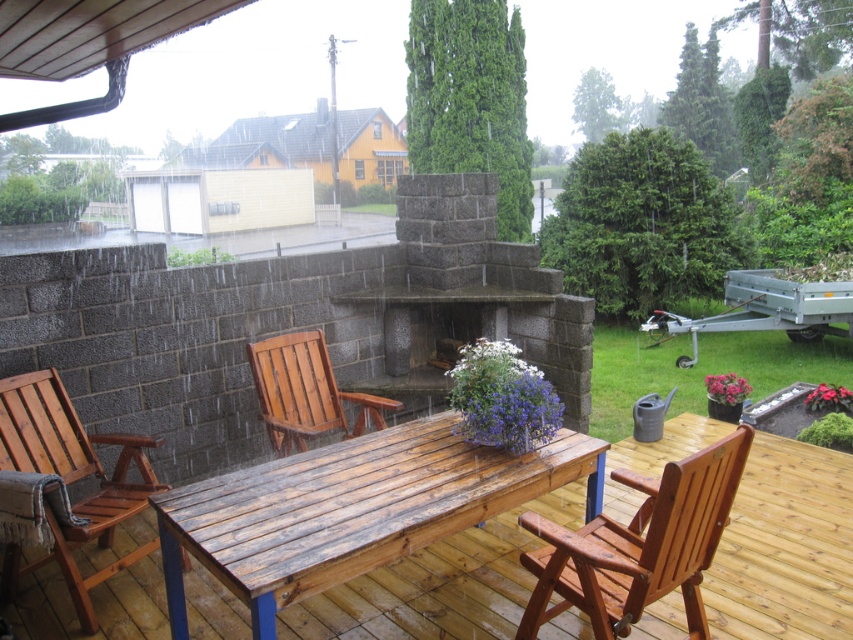
Question: Which of the following is the farthest from the observer?

Choices:
 (A) (439, 272)
 (B) (683, 496)

Answer: (A)

Question: Which point is closer to the camera?

Choices:
 (A) wooden chair at lower right
 (B) wooden chair with woven fabric at left
 (C) wooden table at center

Answer: (C)

Question: Is wooden table at center smaller than gray stone fireplace at center?

Choices:
 (A) yes
 (B) no

Answer: (A)

Question: Is wooden chair at lower right to the right of wooden chair at center from the viewer's perspective?

Choices:
 (A) yes
 (B) no

Answer: (A)

Question: Is wooden table at center wider than wooden chair at lower right?

Choices:
 (A) no
 (B) yes

Answer: (B)

Question: Among these objects, which one is nearest to the camera?

Choices:
 (A) wooden chair with woven fabric at left
 (B) wooden table at center

Answer: (B)